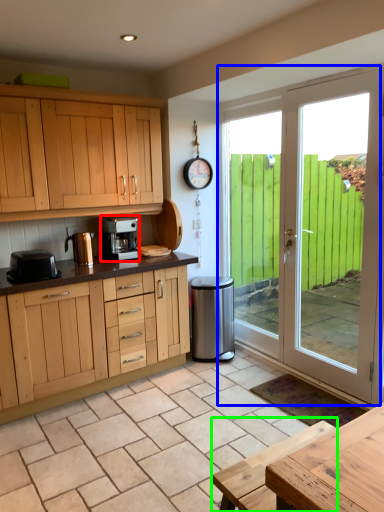
Question: Which object is the closest to the kitchen appliance (highlighted by a red box)? Choose among these: door (highlighted by a blue box) or table (highlighted by a green box).

Choices:
 (A) door
 (B) table

Answer: (A)